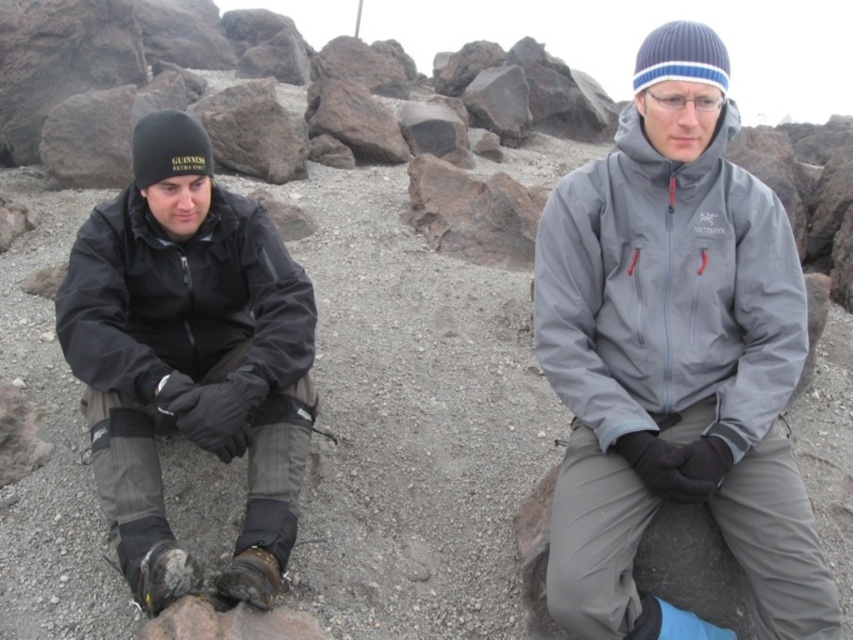
Between gray softshell jacket at center and black matte jacket at left, which one appears on the left side from the viewer's perspective?

black matte jacket at left

Describe the element at coordinates (674, 358) in the screenshot. This screenshot has height=640, width=853. I see `gray softshell jacket at center` at that location.

Which is in front, point (663, 164) or point (196, 342)?

Positioned in front is point (663, 164).

Where is `gray softshell jacket at center`? This screenshot has width=853, height=640. gray softshell jacket at center is located at coordinates (674, 358).